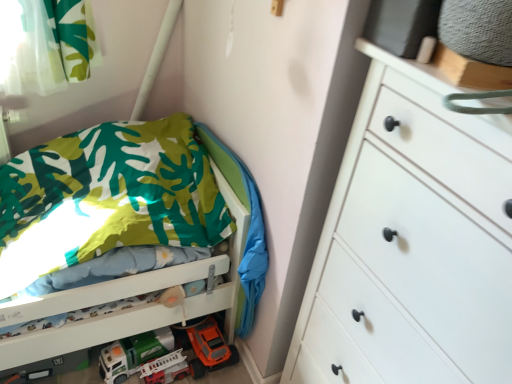
What is the approximate height of white matte chest of drawers at right?

4.26 feet.

Describe the element at coordinates (131, 233) in the screenshot. I see `printed fabric bed at left` at that location.

Image resolution: width=512 pixels, height=384 pixels. I want to click on white plastic toy car at lower center, which is the first toy car in left-to-right order, so click(x=133, y=354).

Where is `green fabric blanket at lower left`? This screenshot has width=512, height=384. green fabric blanket at lower left is located at coordinates (248, 229).

The image size is (512, 384). I want to click on the 2nd toy car below the orange plastic toy car at lower center (from a real-world perspective), so [x=165, y=368].

Is matte white plastic fire truck at lower left, placed as the 2th toy car when sorted from left to right, taller or shorter than orange plastic toy car at lower center?

Considering their sizes, matte white plastic fire truck at lower left, placed as the 2th toy car when sorted from left to right, has less height than orange plastic toy car at lower center.

From a real-world perspective, which object stands above the other?

From a 3D spatial view, orange plastic toy car at lower center is above.

Considering the sizes of orange plastic toy car at lower center and white matte chest of drawers at right in the image, is orange plastic toy car at lower center taller or shorter than white matte chest of drawers at right?

Clearly, orange plastic toy car at lower center is shorter compared to white matte chest of drawers at right.

Is point (222, 349) closer to camera compared to point (398, 336)?

No, it is not.

What's the angular difference between white plastic toy car at lower center, which is the first toy car in left-to-right order, and orange plastic toy car at lower center's facing directions?

The angular difference between white plastic toy car at lower center, which is the first toy car in left-to-right order, and orange plastic toy car at lower center is 79.1 degrees.

Does white plastic toy car at lower center, marked as the second toy car in a right-to-left arrangement, have a larger size compared to orange plastic toy car at lower center?

No.

Is point (105, 364) in front of point (223, 357)?

Yes, it is.

Is white plastic toy car at lower center, which is the first toy car in left-to-right order, closer to camera compared to orange plastic toy car at lower center?

Yes, it is.

From a real-world perspective, is orange plastic toy car at lower center over matte white plastic fire truck at lower left, marked as the first toy car in a right-to-left arrangement?

Yes, from a real-world perspective, orange plastic toy car at lower center is above matte white plastic fire truck at lower left, marked as the first toy car in a right-to-left arrangement.

Is orange plastic toy car at lower center positioned beyond the bounds of matte white plastic fire truck at lower left, marked as the first toy car in a right-to-left arrangement?

Indeed, orange plastic toy car at lower center is completely outside matte white plastic fire truck at lower left, marked as the first toy car in a right-to-left arrangement.

Is orange plastic toy car at lower center closer to the viewer compared to matte white plastic fire truck at lower left, marked as the first toy car in a right-to-left arrangement?

No.

Is orange plastic toy car at lower center thinner than matte white plastic fire truck at lower left, placed as the 2th toy car when sorted from left to right?

Yes.

Which object is closer to the camera, orange plastic toy car at lower center or green fabric blanket at lower left?

green fabric blanket at lower left is closer to the camera.

From a real-world perspective, which object rests below the other?

orange plastic toy car at lower center is physically lower.

Does orange plastic toy car at lower center have a greater width compared to green fabric blanket at lower left?

Yes, orange plastic toy car at lower center is wider than green fabric blanket at lower left.

Considering the relative sizes of orange plastic toy car at lower center and green fabric blanket at lower left in the image provided, is orange plastic toy car at lower center bigger than green fabric blanket at lower left?

Actually, orange plastic toy car at lower center might be smaller than green fabric blanket at lower left.

How different are the orientations of printed fabric bed at left and orange plastic toy car at lower center in degrees?

They differ by 90.8 degrees in their facing directions.

Considering the sizes of objects printed fabric bed at left and orange plastic toy car at lower center in the image provided, who is shorter, printed fabric bed at left or orange plastic toy car at lower center?

With less height is orange plastic toy car at lower center.

From a real-world perspective, between printed fabric bed at left and orange plastic toy car at lower center, who is vertically lower?

In real-world perspective, orange plastic toy car at lower center is lower.

From the image's perspective, is printed fabric bed at left beneath orange plastic toy car at lower center?

No.

You are a GUI agent. You are given a task and a screenshot of the screen. Output one action in this format:
    pyautogui.click(x=<x>, y=<y>)
    Task: Click on the toy car below the white plastic toy car at lower center, which is the first toy car in left-to-right order (from a real-world perspective)
    Image resolution: width=512 pixels, height=384 pixels.
    Given the screenshot: What is the action you would take?
    pyautogui.click(x=165, y=368)

Would you consider white plastic toy car at lower center, marked as the second toy car in a right-to-left arrangement, to be distant from matte white plastic fire truck at lower left, marked as the first toy car in a right-to-left arrangement?

No, white plastic toy car at lower center, marked as the second toy car in a right-to-left arrangement, is in close proximity to matte white plastic fire truck at lower left, marked as the first toy car in a right-to-left arrangement.

Is point (165, 342) farther from viewer compared to point (148, 377)?

Yes, point (165, 342) is farther from viewer.

Can we say white plastic toy car at lower center, marked as the second toy car in a right-to-left arrangement, lies outside matte white plastic fire truck at lower left, marked as the first toy car in a right-to-left arrangement?

That's correct, white plastic toy car at lower center, marked as the second toy car in a right-to-left arrangement, is outside of matte white plastic fire truck at lower left, marked as the first toy car in a right-to-left arrangement.

Locate an element on the screen. Image resolution: width=512 pixels, height=384 pixels. toy positioned vertically above the matte white plastic fire truck at lower left, placed as the 2th toy car when sorted from left to right (from a real-world perspective) is located at coordinates (209, 348).

Where is `the chest of drawers in front of the orange plastic toy car at lower center`? the chest of drawers in front of the orange plastic toy car at lower center is located at coordinates (412, 243).

Considering their positions, is matte white plastic fire truck at lower left, placed as the 2th toy car when sorted from left to right, positioned further to white plastic toy car at lower center, which is the first toy car in left-to-right order, than white matte chest of drawers at right?

white matte chest of drawers at right.

Considering their positions, is printed fabric bed at left positioned closer to orange plastic toy car at lower center than white matte chest of drawers at right?

→ printed fabric bed at left lies closer to orange plastic toy car at lower center than the other object.

Considering their positions, is printed fabric bed at left positioned closer to green fabric blanket at lower left than white plastic toy car at lower center, marked as the second toy car in a right-to-left arrangement?

printed fabric bed at left lies closer to green fabric blanket at lower left than the other object.

Considering their positions, is matte white plastic fire truck at lower left, marked as the first toy car in a right-to-left arrangement, positioned closer to printed fabric bed at left than orange plastic toy car at lower center?

orange plastic toy car at lower center lies closer to printed fabric bed at left than the other object.

When comparing their distances from white plastic toy car at lower center, which is the first toy car in left-to-right order, does white matte chest of drawers at right or green fabric blanket at lower left seem closer?

green fabric blanket at lower left lies closer to white plastic toy car at lower center, which is the first toy car in left-to-right order, than the other object.

Estimate the real-world distances between objects in this image. Which object is further from printed fabric bed at left, orange plastic toy car at lower center or green fabric blanket at lower left?

orange plastic toy car at lower center is further to printed fabric bed at left.

Estimate the real-world distances between objects in this image. Which object is further from orange plastic toy car at lower center, white matte chest of drawers at right or green fabric blanket at lower left?

Among the two, white matte chest of drawers at right is located further to orange plastic toy car at lower center.

Which object lies nearer to the anchor point orange plastic toy car at lower center, green fabric blanket at lower left or white matte chest of drawers at right?

green fabric blanket at lower left lies closer to orange plastic toy car at lower center than the other object.

Where is `blanket positioned between white matte chest of drawers at right and white plastic toy car at lower center, marked as the second toy car in a right-to-left arrangement, from near to far`? The image size is (512, 384). blanket positioned between white matte chest of drawers at right and white plastic toy car at lower center, marked as the second toy car in a right-to-left arrangement, from near to far is located at coordinates (248, 229).

What are the coordinates of `blanket located between printed fabric bed at left and white plastic toy car at lower center, marked as the second toy car in a right-to-left arrangement, in the depth direction` in the screenshot? It's located at (248, 229).

This screenshot has height=384, width=512. In order to click on blanket located between printed fabric bed at left and white matte chest of drawers at right in the left-right direction in this screenshot , I will do `click(248, 229)`.

Find the location of `blanket between printed fabric bed at left and matte white plastic fire truck at lower left, placed as the 2th toy car when sorted from left to right, in the vertical direction`. blanket between printed fabric bed at left and matte white plastic fire truck at lower left, placed as the 2th toy car when sorted from left to right, in the vertical direction is located at coordinates (248, 229).